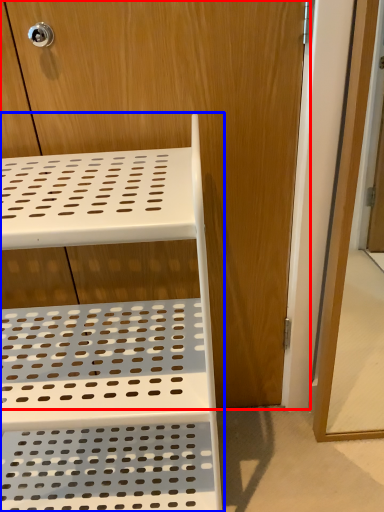
Question: Which object is closer to the camera taking this photo, dresser (highlighted by a red box) or furniture (highlighted by a blue box)?

Choices:
 (A) dresser
 (B) furniture

Answer: (B)